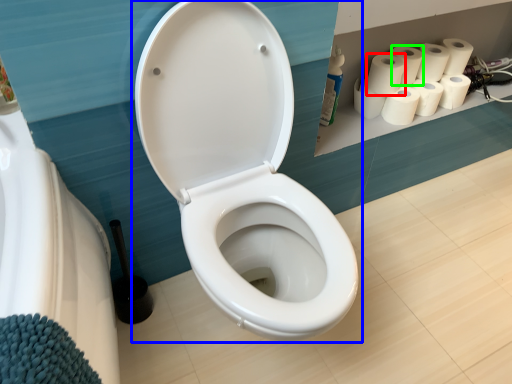
Question: Considering the real-world distances, which object is closest to paper towel (highlighted by a red box)? toilet (highlighted by a blue box) or paper towel (highlighted by a green box).

Choices:
 (A) toilet
 (B) paper towel

Answer: (B)